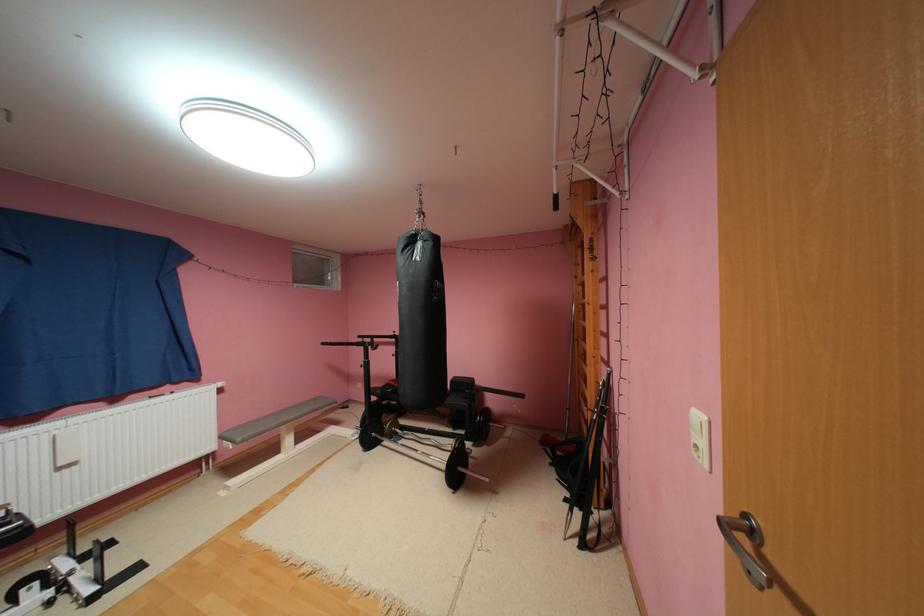
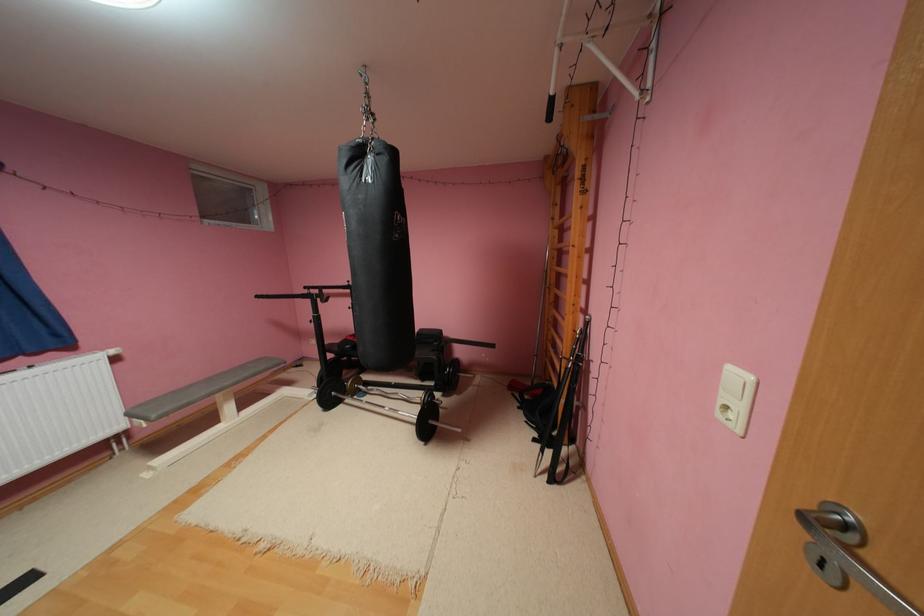
Question: What movement of the cameraman would produce the second image?

Choices:
 (A) Left
 (B) Right
 (C) Forward
 (D) Backward

Answer: (C)